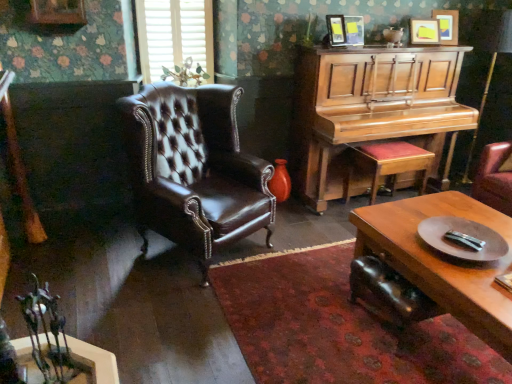
This screenshot has width=512, height=384. I want to click on vacant space situated on the left part of wooden polished coffee table at lower right, so click(x=302, y=317).